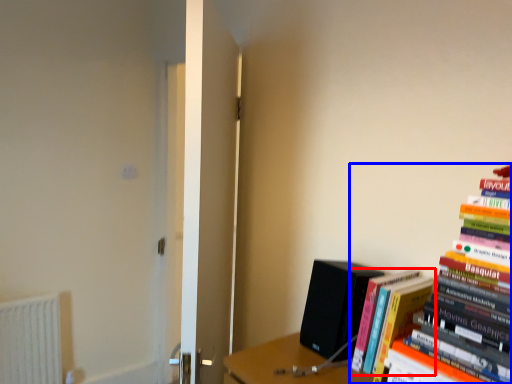
Question: Which object appears farthest to the camera in this image, book (highlighted by a red box) or book (highlighted by a blue box)?

Choices:
 (A) book
 (B) book

Answer: (A)